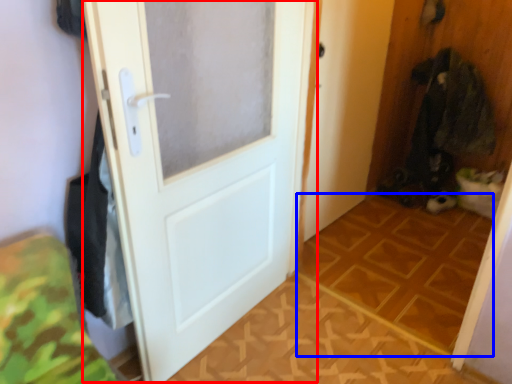
Question: Which of the following is the farthest to the observer, door (highlighted by a red box) or tile (highlighted by a blue box)?

Choices:
 (A) door
 (B) tile

Answer: (B)